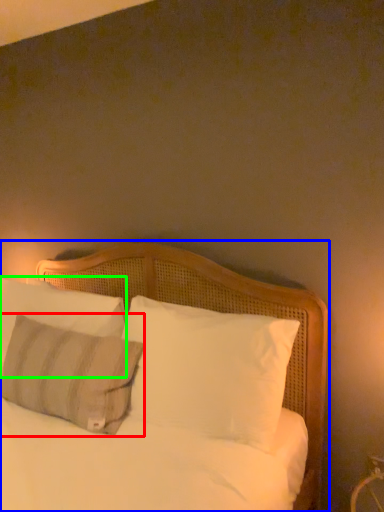
Question: Which object is the farthest from pillow (highlighted by a red box)? Choose among these: bed (highlighted by a blue box) or pillow (highlighted by a green box).

Choices:
 (A) bed
 (B) pillow

Answer: (A)